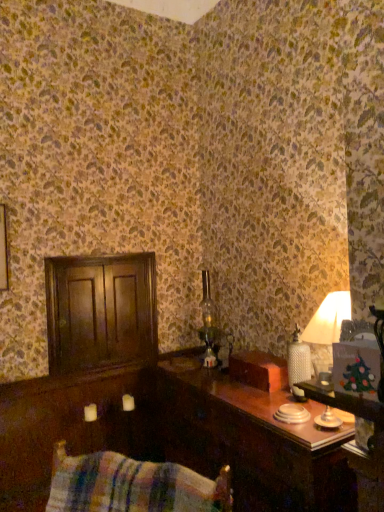
Question: From the image's perspective, is plaid fabric swivel chair at lower left positioned above or below dark wood dresser at left?

Choices:
 (A) below
 (B) above

Answer: (A)

Question: Is plaid fabric swivel chair at lower left wider or thinner than dark wood dresser at left?

Choices:
 (A) wide
 (B) thin

Answer: (A)

Question: Which is nearer to the plaid fabric swivel chair at lower left?

Choices:
 (A) wooden table at right
 (B) dark wood dresser at left

Answer: (A)

Question: Based on their relative distances, which object is farther from the wooden table at right?

Choices:
 (A) dark wood dresser at left
 (B) plaid fabric swivel chair at lower left

Answer: (B)